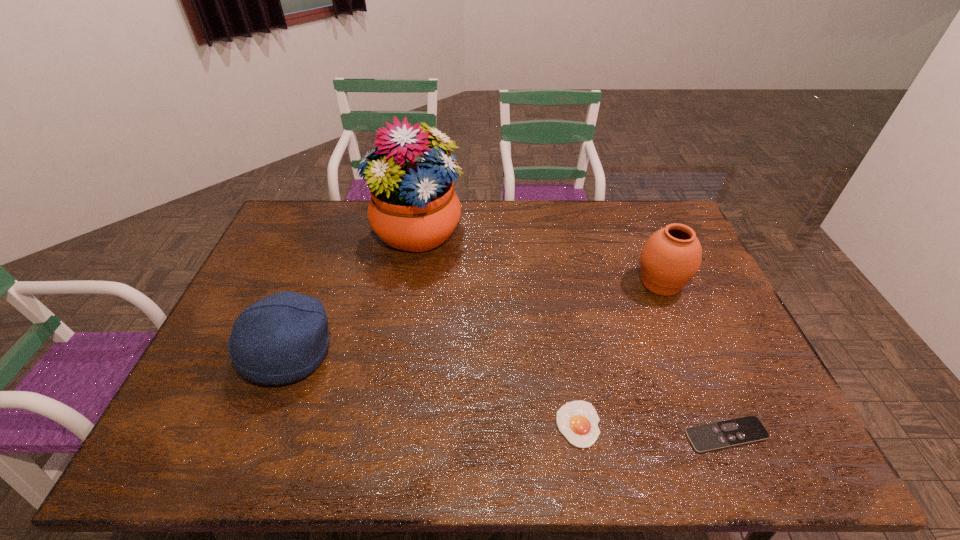
Locate an element on the screen. object positioned at the far edge is located at coordinates (413, 207).

Identify the location of remote control located at the near edge. The width and height of the screenshot is (960, 540). (738, 431).

Identify the location of egg yolk present at the near edge. The height and width of the screenshot is (540, 960). (577, 420).

This screenshot has height=540, width=960. Identify the location of object that is at the left edge. (281, 338).

Locate an element on the screen. Image resolution: width=960 pixels, height=540 pixels. urn that is at the right edge is located at coordinates (670, 258).

You are a GUI agent. You are given a task and a screenshot of the screen. Output one action in this format:
    pyautogui.click(x=<x>, y=<y>)
    Task: Click on the remote control present at the right edge
    The width and height of the screenshot is (960, 540).
    Given the screenshot: What is the action you would take?
    pyautogui.click(x=738, y=431)

Where is `object located at the near right corner`? The height and width of the screenshot is (540, 960). object located at the near right corner is located at coordinates (738, 431).

The image size is (960, 540). Identify the location of free space at the far edge of the desktop. (538, 213).

The height and width of the screenshot is (540, 960). I want to click on vacant space at the near edge of the desktop, so click(551, 448).

Locate an element on the screen. The height and width of the screenshot is (540, 960). free spot at the left edge of the desktop is located at coordinates (290, 286).